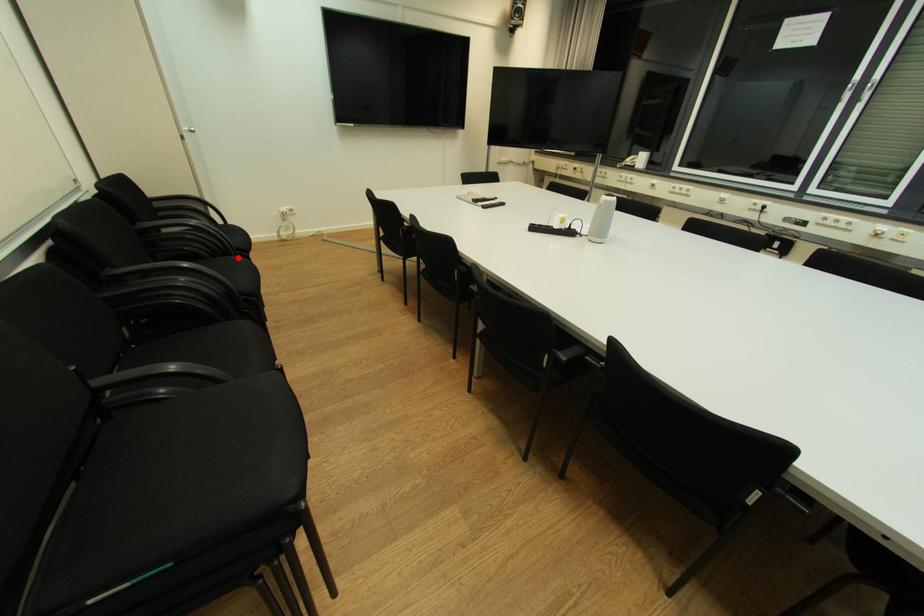
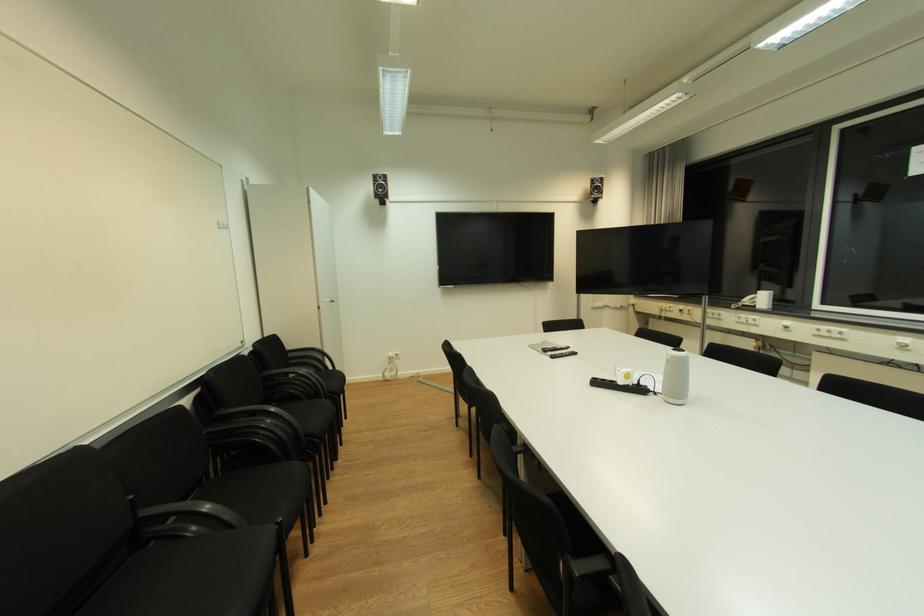
Question: A red point is marked in image1. In image2, is the corresponding 3D point closer to the camera or farther? Reply with the corresponding letter.

Choices:
 (A) The corresponding 3D point is closer.
 (B) The corresponding 3D point is farther.

Answer: (A)